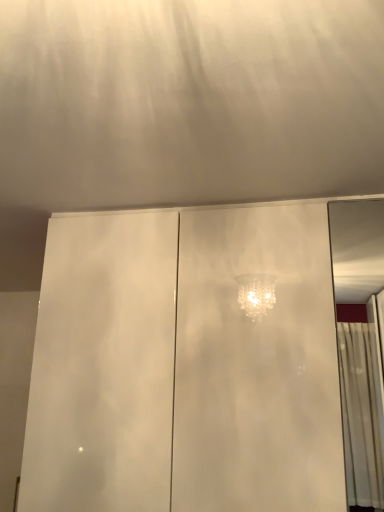
What do you see at coordinates (185, 365) in the screenshot?
I see `white glossy cabinet at center` at bounding box center [185, 365].

The height and width of the screenshot is (512, 384). I want to click on white glossy cabinet at center, so click(x=185, y=365).

This screenshot has height=512, width=384. I want to click on white glossy cabinet at center, so click(185, 365).